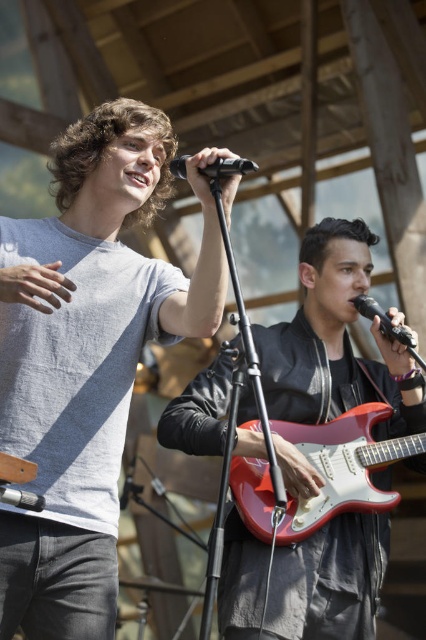
Question: Does shiny black guitar at center lie in front of black matte microphone at right?

Choices:
 (A) yes
 (B) no

Answer: (A)

Question: Which is nearer to the glossy red electric guitar at lower right?

Choices:
 (A) black matte microphone at right
 (B) black matte microphone at center
 (C) gray cotton t-shirt at center

Answer: (A)

Question: Which object appears closest to the camera in this image?

Choices:
 (A) glossy red electric guitar at lower right
 (B) shiny black guitar at center
 (C) black matte microphone at center
 (D) gray cotton t-shirt at center

Answer: (C)

Question: Does shiny black guitar at center have a greater width compared to black matte microphone at right?

Choices:
 (A) no
 (B) yes

Answer: (B)

Question: In this image, where is gray cotton t-shirt at center located relative to glossy red electric guitar at lower right?

Choices:
 (A) below
 (B) above

Answer: (B)

Question: Which point is closer to the camera?

Choices:
 (A) (342, 337)
 (B) (380, 326)
 (C) (321, 470)

Answer: (C)